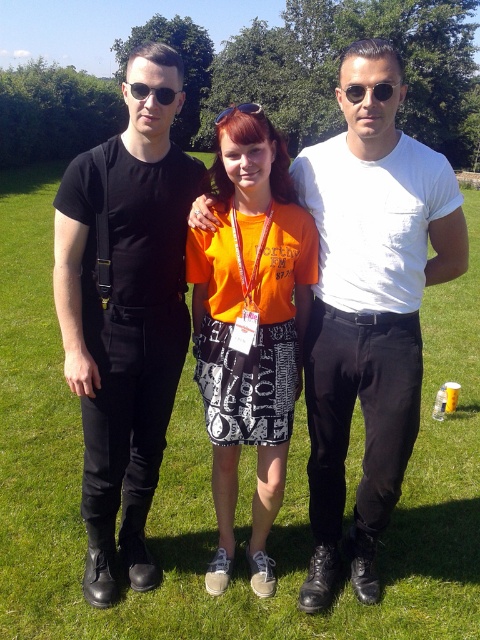
You are standing in a park and see two points marked in the image. One is at coordinates point (132, 349) and the other is at point (137, 96). Which point is closer to you?

Point (132, 349) is closer to you because it is further to the viewer than point (137, 96).